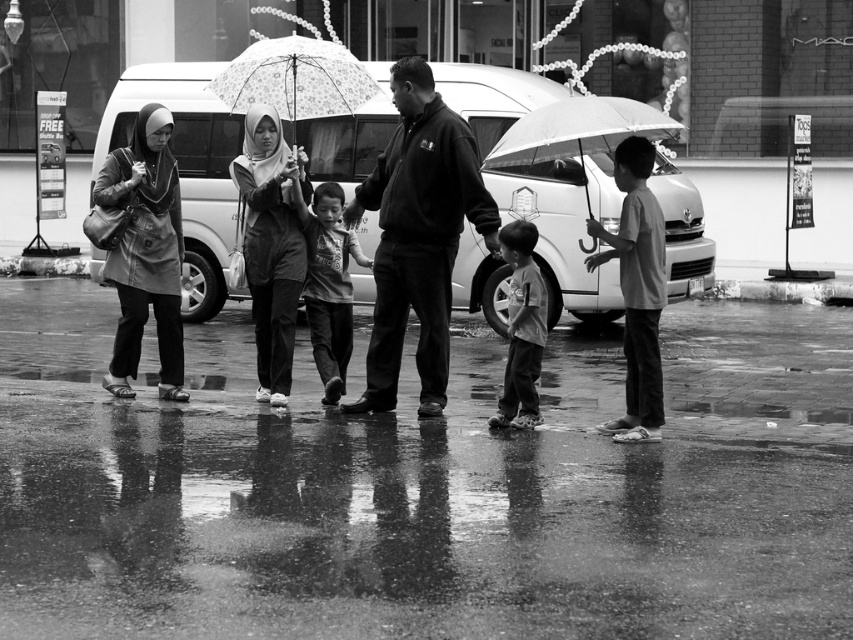
Does point (502, 624) come closer to viewer compared to point (529, 289)?

That is True.

Is point (635, 515) farther from camera compared to point (508, 324)?

No, it is in front of (508, 324).

Is point (166, 435) behind point (527, 317)?

No, (166, 435) is in front of (527, 317).

I want to click on wet asphalt pavement at center, so click(424, 488).

Describe the element at coordinates (187, 168) in the screenshot. The image size is (853, 640). I see `metallic white van at center` at that location.

Consider the image. Between metallic white van at center and transparent plastic umbrella at center, which one has more height?

With more height is metallic white van at center.

What do you see at coordinates (187, 168) in the screenshot? This screenshot has width=853, height=640. I see `metallic white van at center` at bounding box center [187, 168].

The image size is (853, 640). In order to click on metallic white van at center in this screenshot , I will do `click(187, 168)`.

Does light gray cotton shirt at right have a lesser height compared to dark gray cotton shirt at center?

Incorrect, light gray cotton shirt at right's height does not fall short of dark gray cotton shirt at center's.

Does light gray cotton shirt at right have a smaller size compared to dark gray cotton shirt at center?

No, light gray cotton shirt at right is not smaller than dark gray cotton shirt at center.

Which is in front, point (646, 296) or point (512, 381)?

Point (646, 296) is in front.

This screenshot has width=853, height=640. I want to click on light gray cotton shirt at right, so coord(636,289).